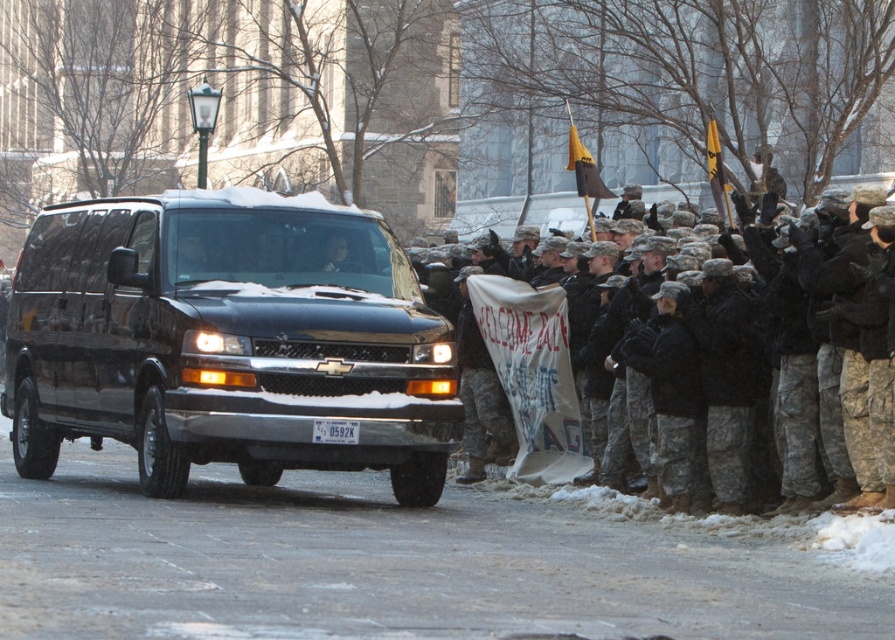
You are a photographer at the scene. You need to position yourself so that both the camouflage fabric uniform at right and the white plastic license plate at center are visible in your photo. Based on their positions, which object should be placed on the right side of the photo frame?

The camouflage fabric uniform at right is to the right of the white plastic license plate at center, so in the photo frame, the camouflage fabric uniform at right should be placed on the right side.

You are a photographer at the military welcome event. You need to capture a photo where both the black matte van at center and the white plastic license plate at center are clearly visible. Considering their sizes, which object will appear larger in the photo?

The black matte van at center will appear larger in the photo because it is taller than the white plastic license plate at center.